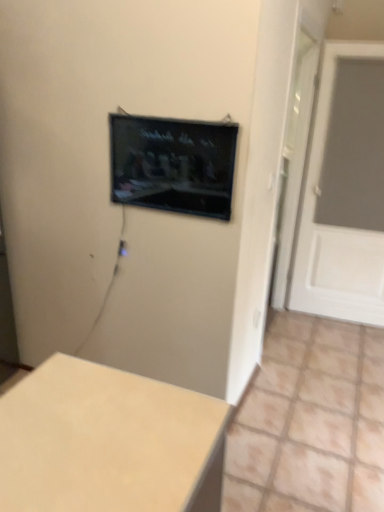
Question: Is white matte door at right thinner than beige matte table at lower left?

Choices:
 (A) no
 (B) yes

Answer: (B)

Question: Considering the relative sizes of white matte door at right and beige matte table at lower left in the image provided, is white matte door at right smaller than beige matte table at lower left?

Choices:
 (A) yes
 (B) no

Answer: (A)

Question: Does white matte door at right come in front of beige matte table at lower left?

Choices:
 (A) no
 (B) yes

Answer: (A)

Question: From the image's perspective, is white matte door at right above beige matte table at lower left?

Choices:
 (A) yes
 (B) no

Answer: (A)

Question: Is white matte door at right outside of beige matte table at lower left?

Choices:
 (A) yes
 (B) no

Answer: (A)

Question: Is beige matte table at lower left to the left or to the right of white matte door at right in the image?

Choices:
 (A) left
 (B) right

Answer: (A)

Question: From a real-world perspective, is beige matte table at lower left above or below white matte door at right?

Choices:
 (A) above
 (B) below

Answer: (B)

Question: Looking at the image, does beige matte table at lower left seem bigger or smaller compared to white matte door at right?

Choices:
 (A) small
 (B) big

Answer: (B)

Question: Is beige matte table at lower left wider or thinner than white matte door at right?

Choices:
 (A) thin
 (B) wide

Answer: (B)

Question: Is point (72, 438) closer or farther from the camera than point (211, 128)?

Choices:
 (A) closer
 (B) farther

Answer: (A)

Question: In terms of width, does beige matte table at lower left look wider or thinner when compared to black glossy tv at upper center?

Choices:
 (A) wide
 (B) thin

Answer: (A)

Question: Considering their positions, is beige matte table at lower left located in front of or behind black glossy tv at upper center?

Choices:
 (A) behind
 (B) front

Answer: (B)

Question: From the image's perspective, relative to black glossy tv at upper center, is beige matte table at lower left above or below?

Choices:
 (A) below
 (B) above

Answer: (A)

Question: Would you say black glossy tv at upper center is inside or outside beige matte table at lower left?

Choices:
 (A) outside
 (B) inside

Answer: (A)

Question: Relative to beige matte table at lower left, is black glossy tv at upper center in front or behind?

Choices:
 (A) behind
 (B) front

Answer: (A)